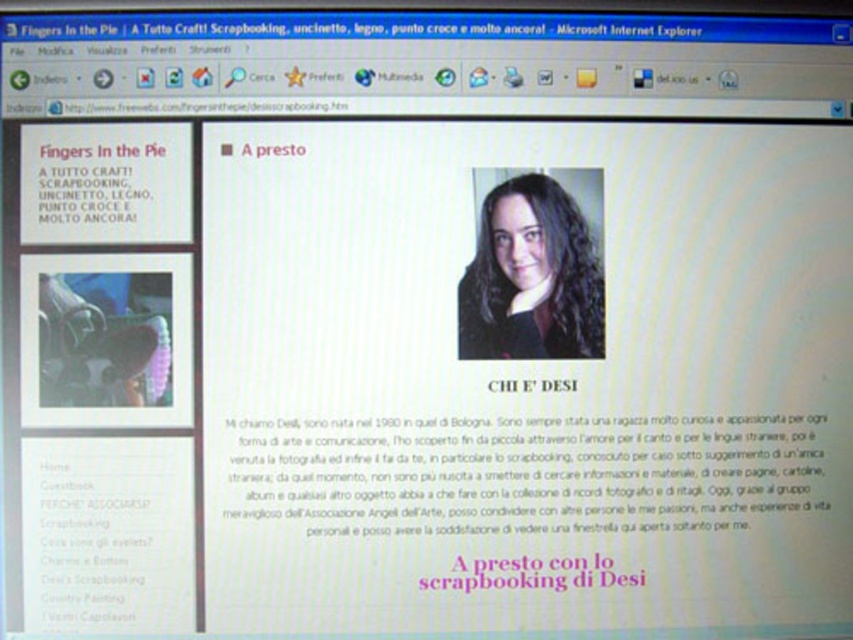
You are designing a digital poster and need to ensure that the pink paper at center and the whitetexttext at center are arranged properly. Based on the webpage layout from the browser Microsoft Internet Explorer, which object should be placed higher on the poster to maintain visual hierarchy?

The pink paper at center should be placed higher on the poster since it has a greater height compared to the whitetexttext at center, making it more prominent in the visual hierarchy.

You are looking at a webpage about crafting projects. You see a dark brown hair at center and a pink paper at center. Which object is positioned to the left?

The dark brown hair at center is positioned to the left of the pink paper at center.

You are a web designer reviewing this webpage. You notice the pink paper at center and the whitetexttext at center. Which element is visually more prominent based on their spatial arrangement?

The pink paper at center is visually more prominent because it is positioned in front of the whitetexttext at center, making it stand out more to the viewer.